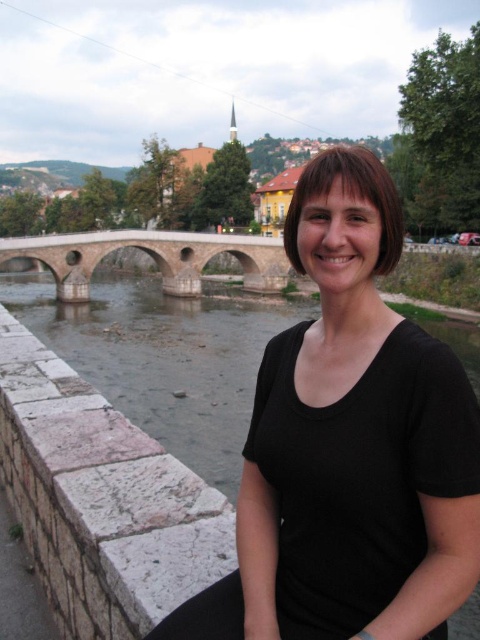
You are a photographer trying to capture the black matte shirt at center and the stone arch bridge at center in a single frame. Which object should you focus on first if you want to ensure both are in focus, considering their sizes in the image?

The black matte shirt at center is taller than the stone arch bridge at center, so you should focus on the black matte shirt at center first to ensure both are in focus.

Please describe the location of the point labeled as point (164, 358) in the image. Which object is it located on?

The point labeled as point (164, 358) is located on the gray stone river at center.

Looking at this image, you are a photographer trying to capture the stone arch bridge at center without the person in the shot. Based on the scene description, can you position yourself in a way to frame the bridge without including the black matte shirt at center in the photo?

The black matte shirt at center is in front of the stone arch bridge at center, so if you move to a position where the shirt is out of the frame or behind the bridge, you can capture the bridge without the person.